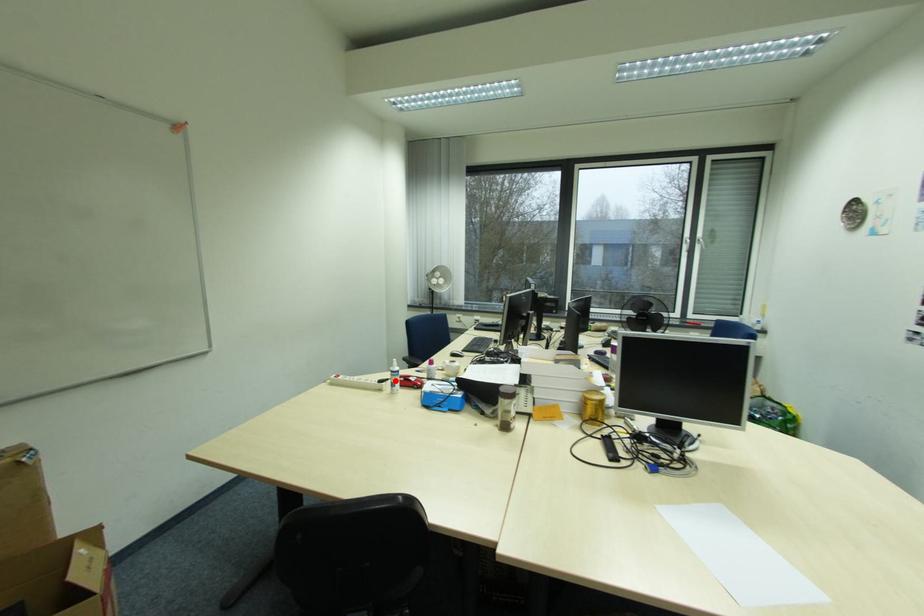
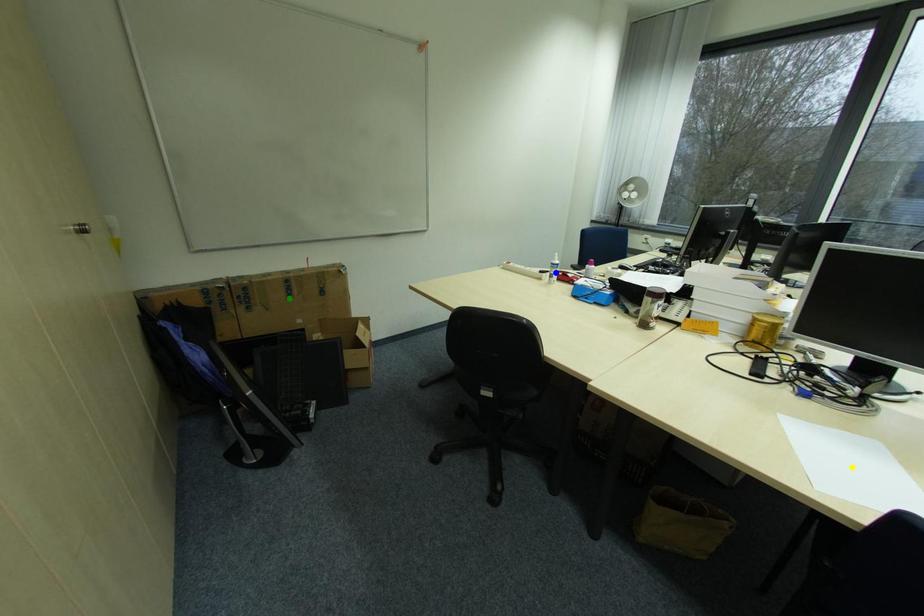
Question: I am providing you with two images of the same scene from different viewpoints. A red point is marked on the first image. You are given multiple points on the second image. Can you choose the point in image 2 that corresponds to the point in image 1?

Choices:
 (A) blue point
 (B) green point
 (C) yellow point

Answer: (A)